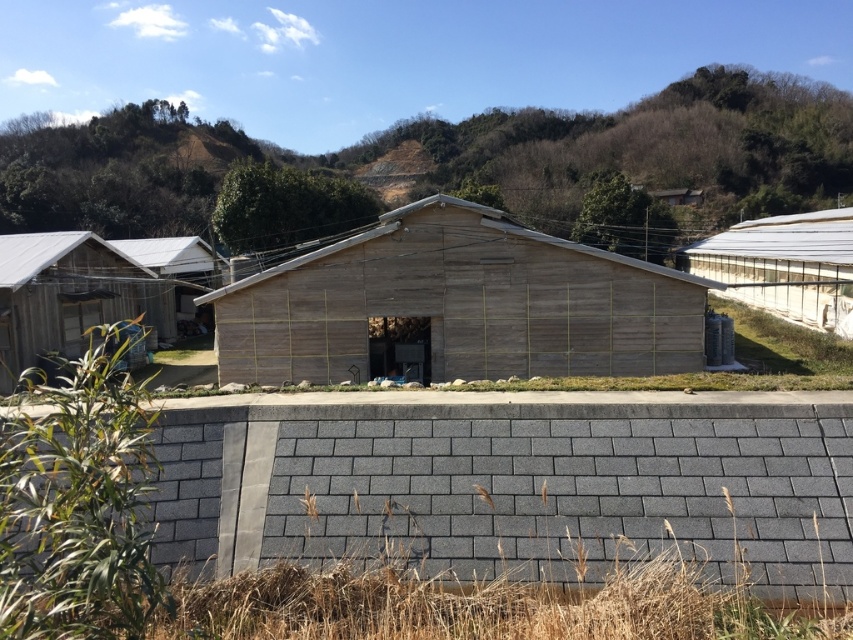
You are standing in a rural area and see the wooden hut at center and the transparent plastic greenhouse at right. Which object is closer to you?

The wooden hut at center is closer to you because it is positioned under the transparent plastic greenhouse at right, meaning it is in front of the greenhouse.

In the scene shown: You are planning to place a new garden shed in the yard. You have two options to choose from the image. The wooden hut at left and the transparent plastic greenhouse at right. Which one has a smaller width so that it can fit into your narrow space?

The wooden hut at left has a lesser width compared to the transparent plastic greenhouse at right, so it can fit into the narrow space better.

You are standing in a rural area and see a wooden hut at left and a transparent plastic greenhouse at right. Which structure is nearer to you?

The wooden hut at left is closer to the viewer than the transparent plastic greenhouse at right.